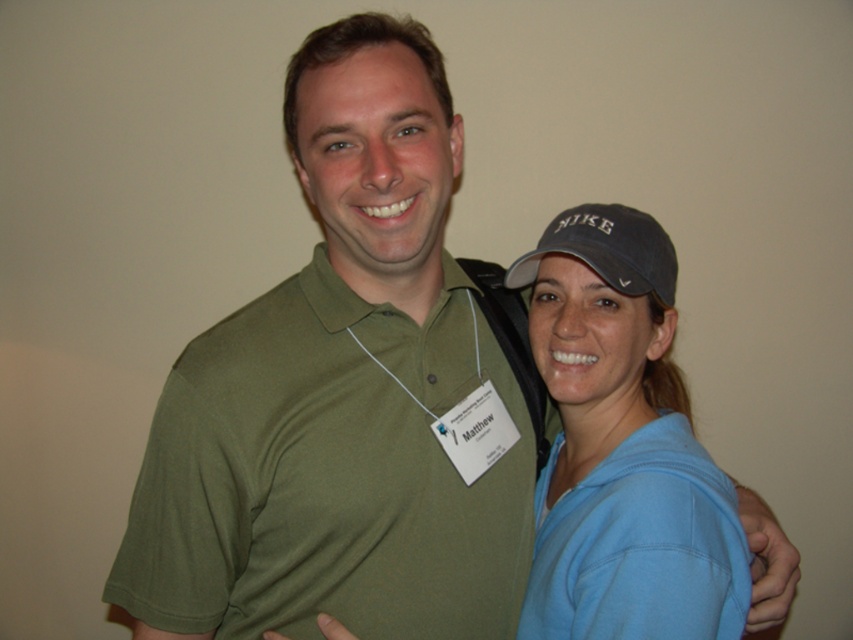
You are a photographer taking a group photo of two people standing against a wall. You notice the blue cotton polo shirt at right and the dark gray fabric baseball cap at upper right. Which object is positioned lower in the image?

The blue cotton polo shirt at right is below the dark gray fabric baseball cap at upper right, so the blue cotton polo shirt at right is positioned lower in the image.

Based on the photo, you are taking a photo of two people standing against a wall. You need to ensure that the blue cotton polo shirt at right is centered in the frame. Based on the coordinates provided, where should you position the camera relative to the shirt?

The blue cotton polo shirt at right is located at coordinates point [639,545]. To center it in the frame, position the camera so that the shirt aligns with the center point of the image, which is typically at coordinates [426,320]. Adjust the camera to move it towards the lower right direction to bring the shirt into the center.

You are organizing a photo shoot and need to ensure that the olive green jersey at center and the dark gray fabric baseball cap at upper right are visible in the frame. Based on their positions, which object is located lower in the image?

The olive green jersey at center is positioned under the dark gray fabric baseball cap at upper right, so the olive green jersey at center is located lower in the image.